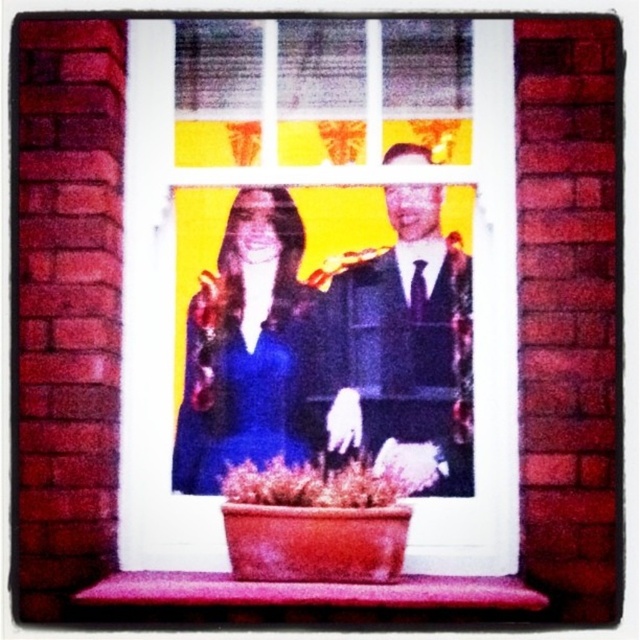
Question: Is white plastic window frame at center above matte blue dress at center?

Choices:
 (A) yes
 (B) no

Answer: (A)

Question: Is matte blue dress at center to the right of green matte plant at center from the viewer's perspective?

Choices:
 (A) no
 (B) yes

Answer: (A)

Question: Which point is farther to the camera?

Choices:
 (A) (472, 586)
 (B) (452, 488)
 (C) (276, 204)
 (D) (481, 120)

Answer: (C)

Question: Which object is the farthest from the satin black suit at center?

Choices:
 (A) pink matte window sill at lower center
 (B) matte blue dress at center
 (C) green matte plant at center

Answer: (A)

Question: Is white plastic window frame at center above pink matte window sill at lower center?

Choices:
 (A) no
 (B) yes

Answer: (B)

Question: Which of the following is the closest to the observer?

Choices:
 (A) pink matte window sill at lower center
 (B) satin black suit at center

Answer: (A)